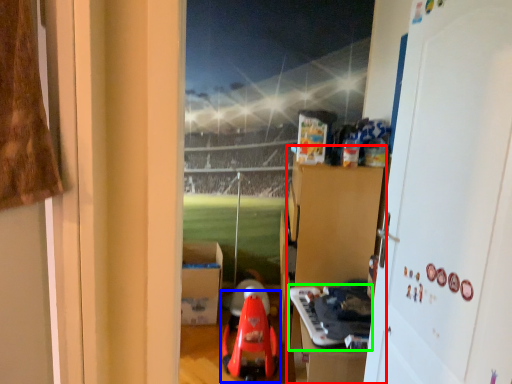
Question: Estimate the real-world distances between objects in this image. Which object is farther from dresser (highlighted by a red box), toy (highlighted by a blue box) or toy (highlighted by a green box)?

Choices:
 (A) toy
 (B) toy

Answer: (A)